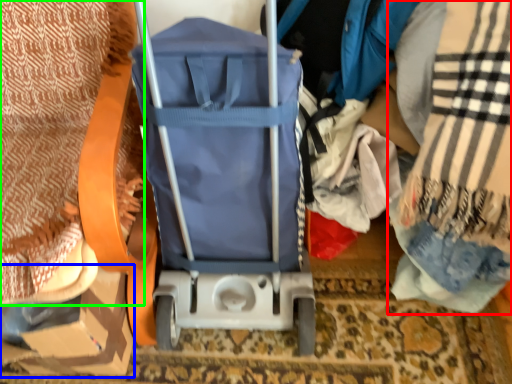
Question: Which object is the closest to the blanket (highlighted by a red box)? Choose among these: cardboard box (highlighted by a blue box) or blanket (highlighted by a green box).

Choices:
 (A) cardboard box
 (B) blanket

Answer: (A)